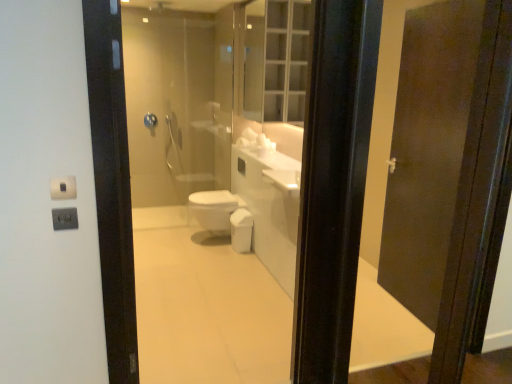
Identify the location of clear glass medicine cabinet at upper center. tap(276, 60).

Where is `white glossy bidet at center`? Image resolution: width=512 pixels, height=384 pixels. white glossy bidet at center is located at coordinates (214, 211).

Can you see blue plastic towel bar at upper center touching white glossy bidet at center?

No, blue plastic towel bar at upper center is not making contact with white glossy bidet at center.

From the image's perspective, which one is positioned higher, blue plastic towel bar at upper center or white glossy bidet at center?

blue plastic towel bar at upper center.

Considering the sizes of blue plastic towel bar at upper center and white glossy bidet at center in the image, is blue plastic towel bar at upper center wider or thinner than white glossy bidet at center?

In the image, blue plastic towel bar at upper center appears to be more narrow than white glossy bidet at center.

Is blue plastic towel bar at upper center to the left of clear glass medicine cabinet at upper center from the viewer's perspective?

Correct, you'll find blue plastic towel bar at upper center to the left of clear glass medicine cabinet at upper center.

From a real-world perspective, is blue plastic towel bar at upper center on top of clear glass medicine cabinet at upper center?

Incorrect, from a real-world perspective, blue plastic towel bar at upper center is lower than clear glass medicine cabinet at upper center.

Can you confirm if blue plastic towel bar at upper center is wider than clear glass medicine cabinet at upper center?

In fact, blue plastic towel bar at upper center might be narrower than clear glass medicine cabinet at upper center.

From the image's perspective, is blue plastic towel bar at upper center positioned above or below clear glass medicine cabinet at upper center?

blue plastic towel bar at upper center is situated lower than clear glass medicine cabinet at upper center in the image.

Is point (234, 201) closer to viewer compared to point (154, 126)?

Yes.

Which is in front, white glossy bidet at center or blue plastic towel bar at upper center?

white glossy bidet at center is closer to the camera.

From the image's perspective, which object appears higher, white glossy bidet at center or blue plastic towel bar at upper center?

From the image's view, blue plastic towel bar at upper center is above.

Between white glossy bidet at center and clear glass medicine cabinet at upper center, which one has larger size?

With larger size is clear glass medicine cabinet at upper center.

Is white glossy bidet at center positioned far away from clear glass medicine cabinet at upper center?

Yes, white glossy bidet at center and clear glass medicine cabinet at upper center are quite far apart.

Which object is positioned more to the right, white glossy bidet at center or clear glass medicine cabinet at upper center?

clear glass medicine cabinet at upper center is more to the right.

From a real-world perspective, which object rests below the other?

In real-world perspective, white glossy bidet at center is lower.

Could you tell me if clear glass medicine cabinet at upper center is facing blue plastic towel bar at upper center?

No.

Locate an element on the screen. The height and width of the screenshot is (384, 512). medicine cabinet that appears in front of the blue plastic towel bar at upper center is located at coordinates (276, 60).

From a real-world perspective, is clear glass medicine cabinet at upper center located beneath blue plastic towel bar at upper center?

No, from a real-world perspective, clear glass medicine cabinet at upper center is not under blue plastic towel bar at upper center.

Who is shorter, clear glass medicine cabinet at upper center or white glossy bidet at center?

white glossy bidet at center is shorter.

From the image's perspective, is clear glass medicine cabinet at upper center above or below white glossy bidet at center?

Clearly, from the image's perspective, clear glass medicine cabinet at upper center is above white glossy bidet at center.

How many degrees apart are the facing directions of clear glass medicine cabinet at upper center and white glossy bidet at center?

The angle between the facing direction of clear glass medicine cabinet at upper center and the facing direction of white glossy bidet at center is 1.14 degrees.

Is clear glass medicine cabinet at upper center positioned in front of white glossy bidet at center?

Yes.

You are a GUI agent. You are given a task and a screenshot of the screen. Output one action in this format:
    pyautogui.click(x=<x>, y=<y>)
    Task: Click on the bidet below the blue plastic towel bar at upper center (from the image's perspective)
    This screenshot has height=384, width=512.
    Given the screenshot: What is the action you would take?
    pyautogui.click(x=214, y=211)

Locate an element on the screen. medicine cabinet that is in front of the blue plastic towel bar at upper center is located at coordinates (276, 60).

Based on their spatial positions, is white glossy bidet at center or clear glass medicine cabinet at upper center closer to blue plastic towel bar at upper center?

white glossy bidet at center lies closer to blue plastic towel bar at upper center than the other object.

Which object lies further to the anchor point clear glass medicine cabinet at upper center, white glossy bidet at center or blue plastic towel bar at upper center?

The object further to clear glass medicine cabinet at upper center is blue plastic towel bar at upper center.

From the image, which object appears to be nearer to white glossy bidet at center, clear glass medicine cabinet at upper center or blue plastic towel bar at upper center?

Based on the image, clear glass medicine cabinet at upper center appears to be nearer to white glossy bidet at center.

Which object lies nearer to the anchor point white glossy bidet at center, blue plastic towel bar at upper center or clear glass medicine cabinet at upper center?

clear glass medicine cabinet at upper center lies closer to white glossy bidet at center than the other object.

Estimate the real-world distances between objects in this image. Which object is closer to clear glass medicine cabinet at upper center, blue plastic towel bar at upper center or white glossy bidet at center?

Based on the image, white glossy bidet at center appears to be nearer to clear glass medicine cabinet at upper center.

Based on their spatial positions, is clear glass medicine cabinet at upper center or white glossy bidet at center further from blue plastic towel bar at upper center?

The object further to blue plastic towel bar at upper center is clear glass medicine cabinet at upper center.

In order to click on towel bar between clear glass medicine cabinet at upper center and white glossy bidet at center vertically in this screenshot , I will do `click(150, 120)`.